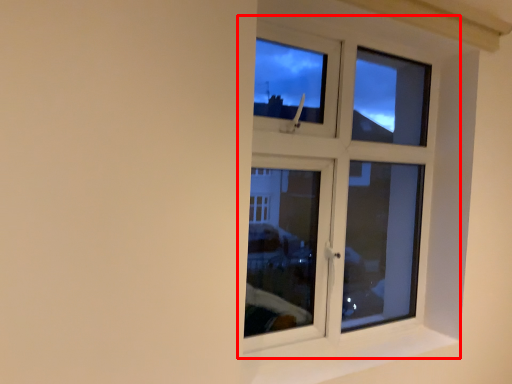
Question: Observing the image, what is the correct spatial positioning of window (annotated by the red box) in reference to window sill?

Choices:
 (A) right
 (B) left

Answer: (B)